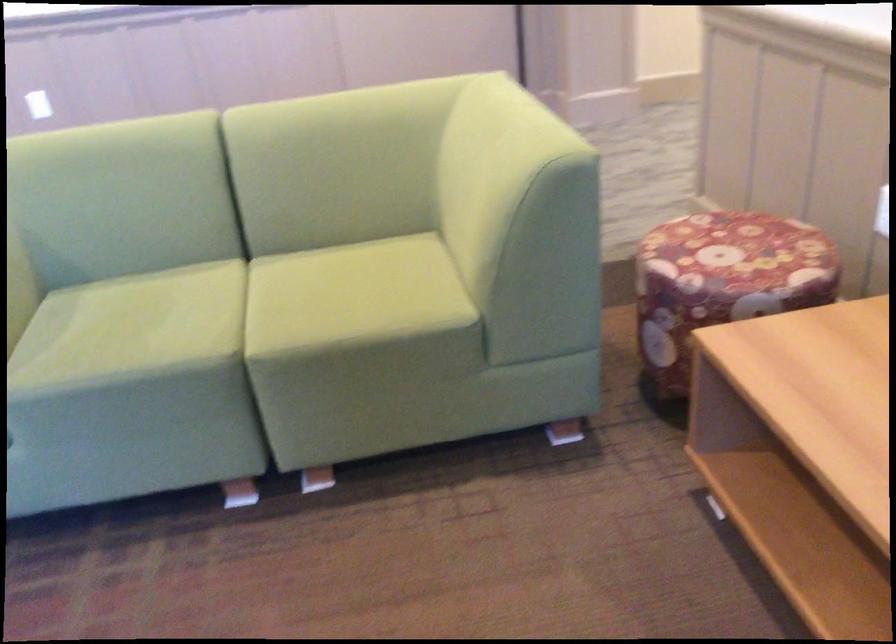
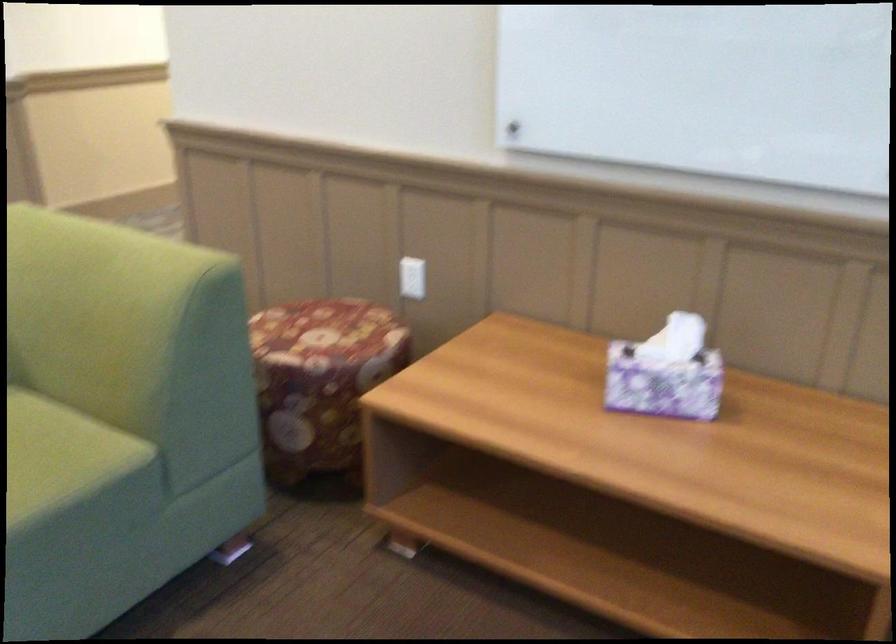
Question: The camera is either moving clockwise (left) or counter-clockwise (right) around the object. The first image is from the beginning of the video and the second image is from the end. Is the camera moving left or right when shooting the video?

Choices:
 (A) Left
 (B) Right

Answer: (A)